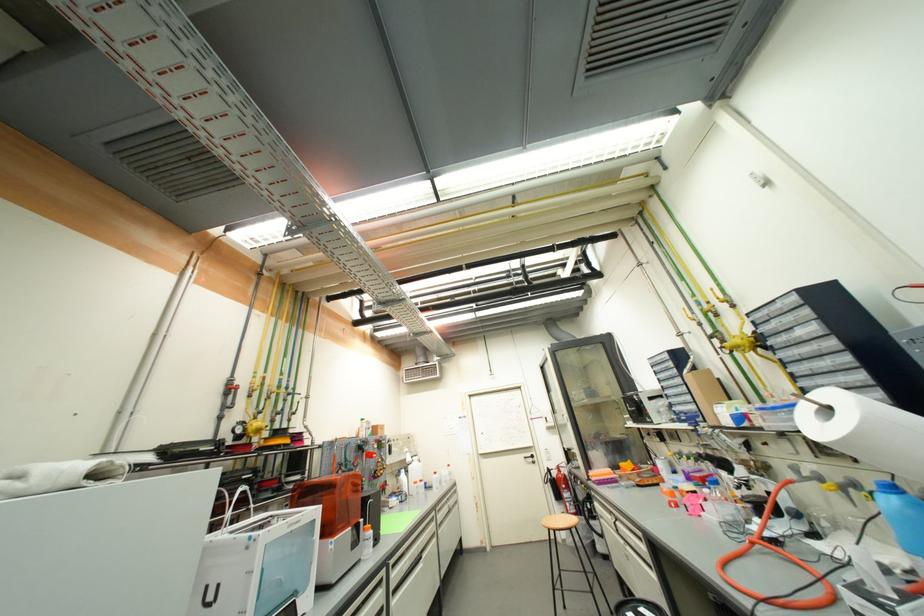
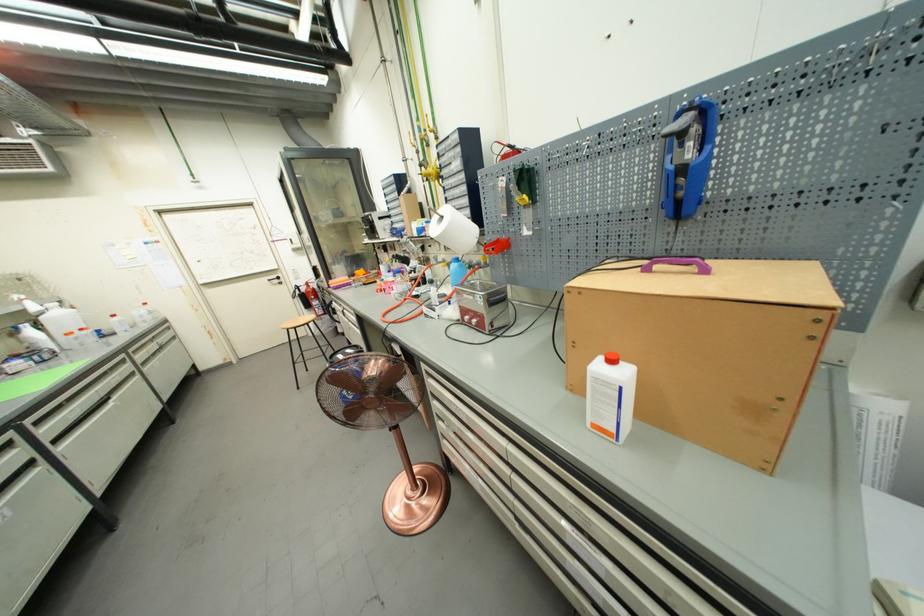
Find the pixel in the second image that matches the point at 444,525 in the first image.

(146, 363)